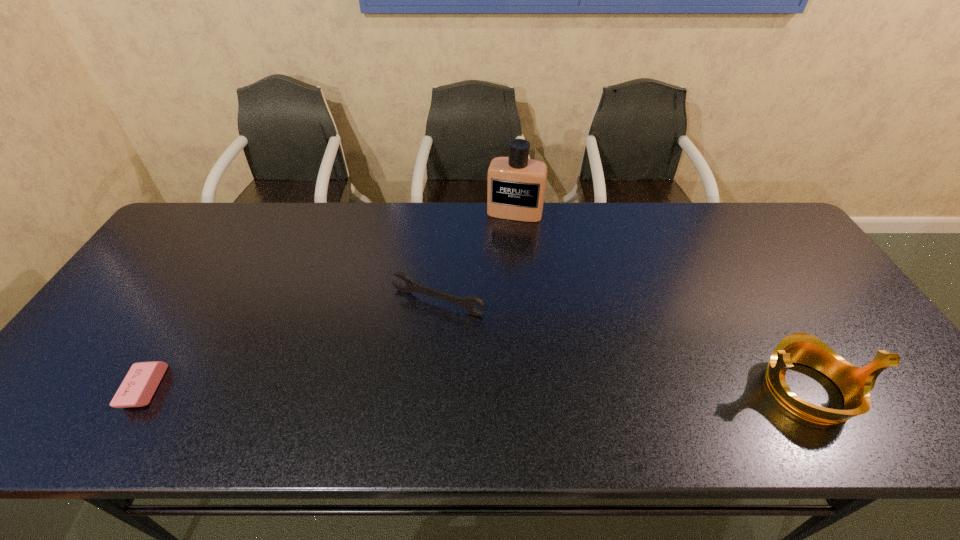
In order to click on free space on the desktop that is between the shortest object and the tiara and is positioned on the open ends of the second shortest object in this screenshot , I will do `click(380, 389)`.

Where is `free space on the desktop that is between the leftmost object and the second tallest object and is positioned on the front label of the perfume`? Image resolution: width=960 pixels, height=540 pixels. free space on the desktop that is between the leftmost object and the second tallest object and is positioned on the front label of the perfume is located at coordinates (471, 389).